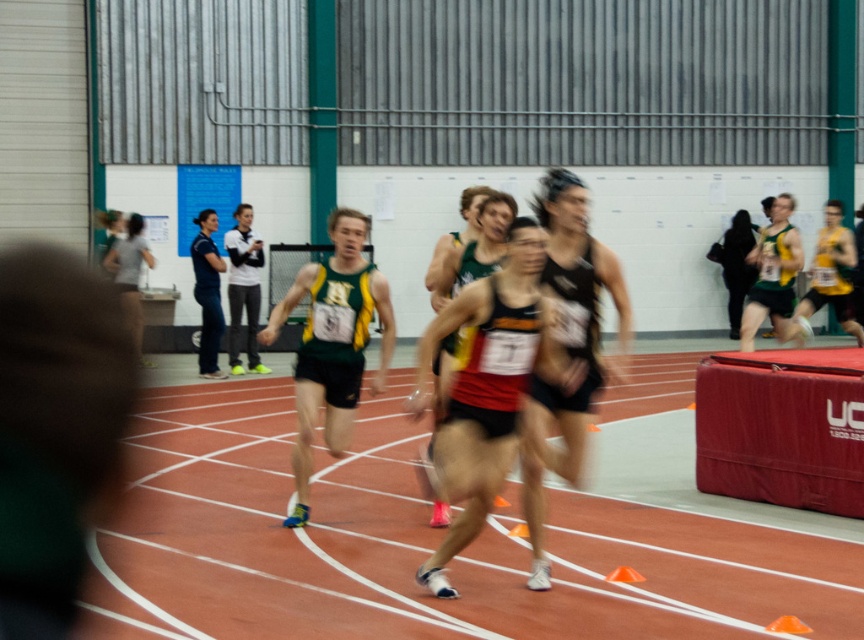
You are a photographer at the indoor track event. You need to capture a photo that includes both the dark blue jersey at center and the black fabric jacket at right. Which object should you zoom in on to ensure both are in frame without cropping?

To include both the dark blue jersey at center and the black fabric jacket at right in the photo without cropping, you should zoom in on the dark blue jersey at center since it is smaller than the black fabric jacket at right, allowing more space for both in the frame.